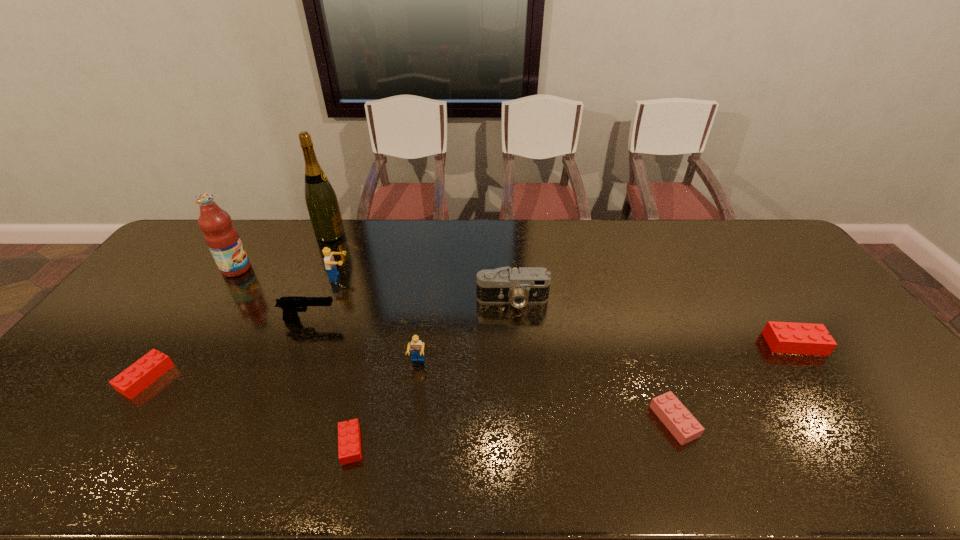
The image size is (960, 540). I want to click on free point between the fourth Lego from left to right and the second Lego from right to left, so click(546, 392).

Find the location of a particular element. unoccupied position between the pink Lego and the fourth farthest object is located at coordinates (593, 361).

I want to click on free space between the leftmost red Lego and the ninth shortest object, so click(191, 323).

At what (x,y) coordinates should I click in order to perform the action: click on free area in between the farthest object and the sixth nearest object. Please return your answer as a coordinate pair (x, y). Looking at the image, I should click on (320, 277).

The height and width of the screenshot is (540, 960). I want to click on object that is the ninth closest one to the tallest Lego, so [782, 337].

Locate an element on the screen. The width and height of the screenshot is (960, 540). the second closest object relative to the fruit juice is located at coordinates (290, 305).

What are the coordinates of `Lego that stands as the fifth closest to the black pistol` in the screenshot? It's located at click(674, 415).

At what (x,y) coordinates should I click in order to perform the action: click on Lego that is the third closest to the leftmost Lego. Please return your answer as a coordinate pair (x, y). Looking at the image, I should click on (416, 346).

Locate an element on the screen. red Lego that stands as the second closest to the biggest red Lego is located at coordinates (137, 377).

Point out which red Lego is positioned as the third nearest to the camera. Please provide its 2D coordinates. Your answer should be formatted as a tuple, i.e. [(x, y)], where the tuple contains the x and y coordinates of a point satisfying the conditions above.

[(137, 377)]